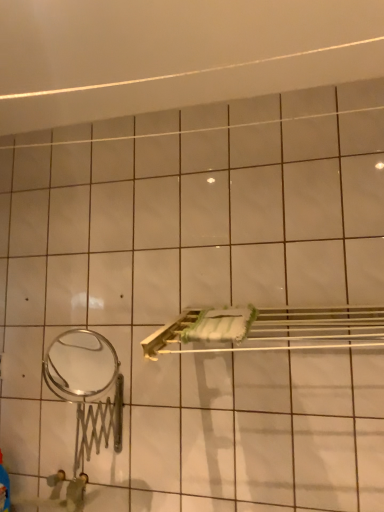
This screenshot has width=384, height=512. What are the coordinates of `metallic silver towel rack at center-right` in the screenshot? It's located at (274, 330).

What do you see at coordinates (274, 330) in the screenshot?
I see `metallic silver towel rack at center-right` at bounding box center [274, 330].

Find the location of a particular element. The height and width of the screenshot is (512, 384). metallic silver towel rack at center-right is located at coordinates (274, 330).